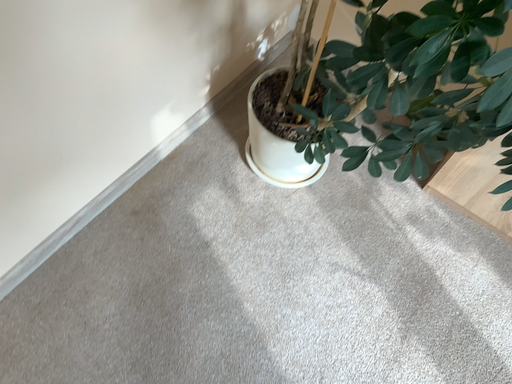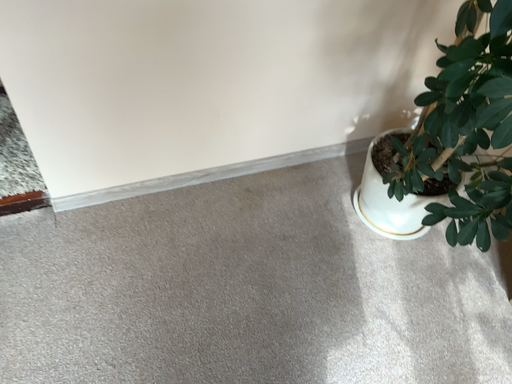
Question: How did the camera likely rotate when shooting the video?

Choices:
 (A) rotated left
 (B) rotated right

Answer: (A)